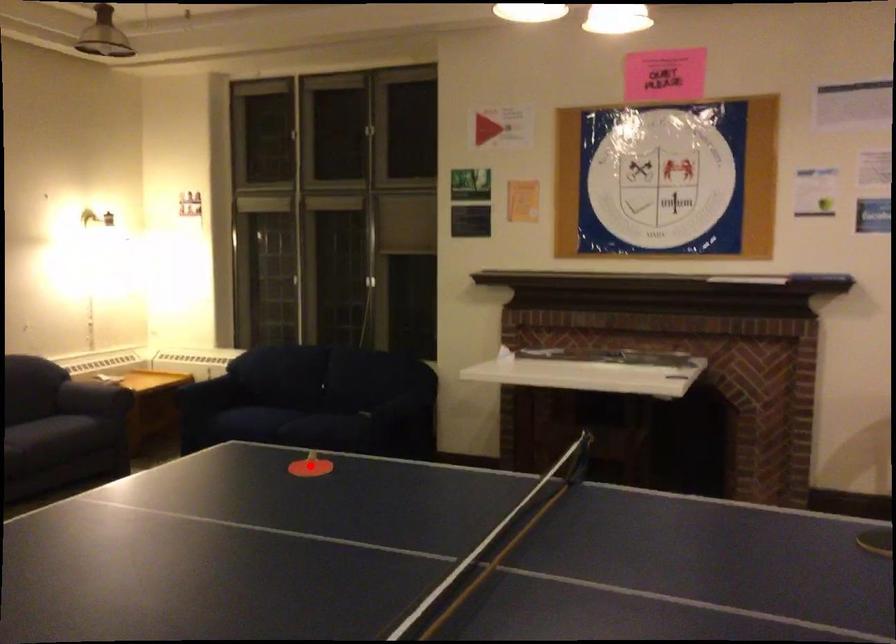
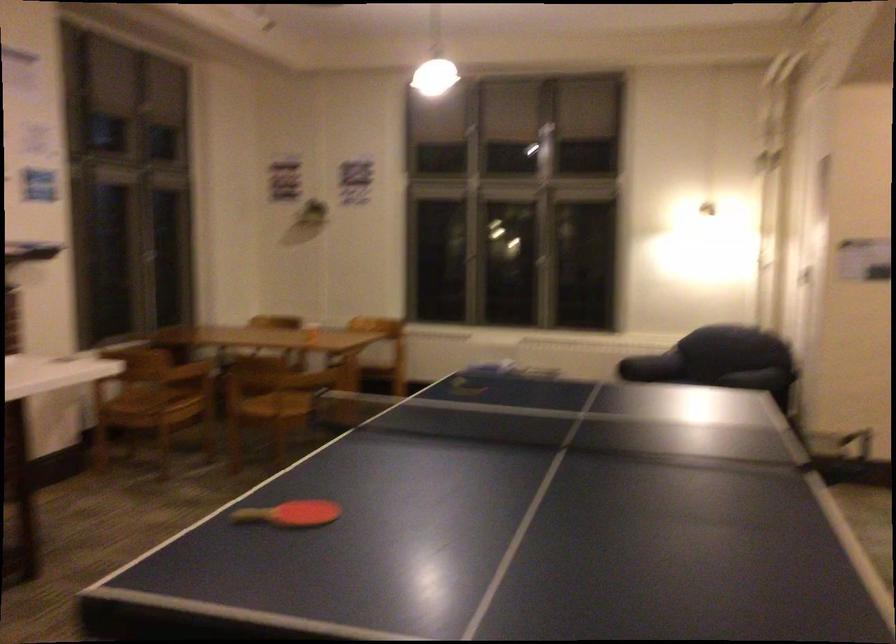
Question: I am providing you with two images of the same scene from different viewpoints. A red point is marked on the first image. At the location where the point appears in image 1, is it still visible in image 2?

Choices:
 (A) Yes
 (B) No

Answer: (B)